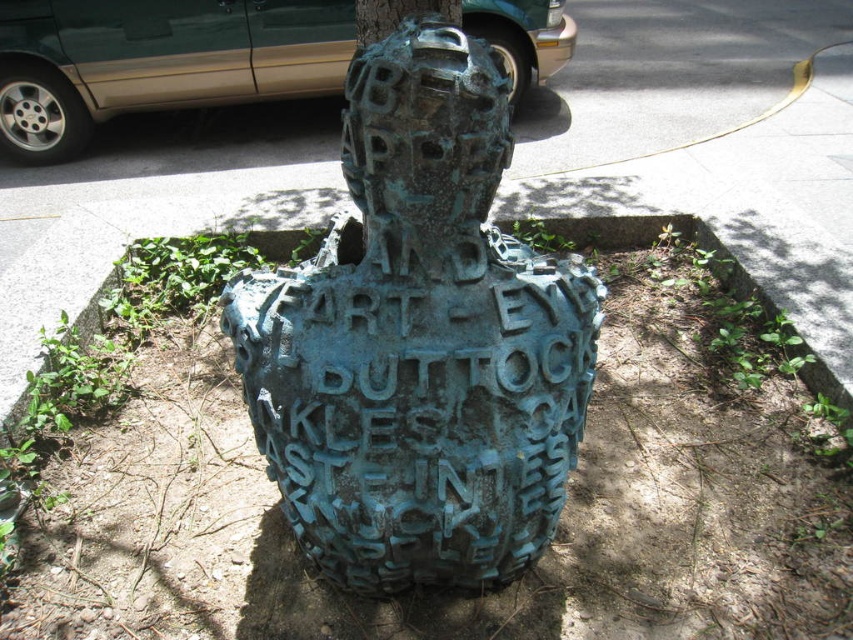
You are standing in front of the sculpture and notice a point marked at coordinates (155, 61). Based on the sculpture description, what object does this point likely represent?

The point at coordinates (155, 61) corresponds to the green matte van at upper left.

You are a photographer trying to capture both the green patina metal sculpture at center and the green matte van at upper left in a single frame. Based on their positions, which object should you position closer to the left side of your camera viewfinder?

The green matte van at upper left should be positioned closer to the left side of your camera viewfinder since the green patina metal sculpture at center is to the right of it.